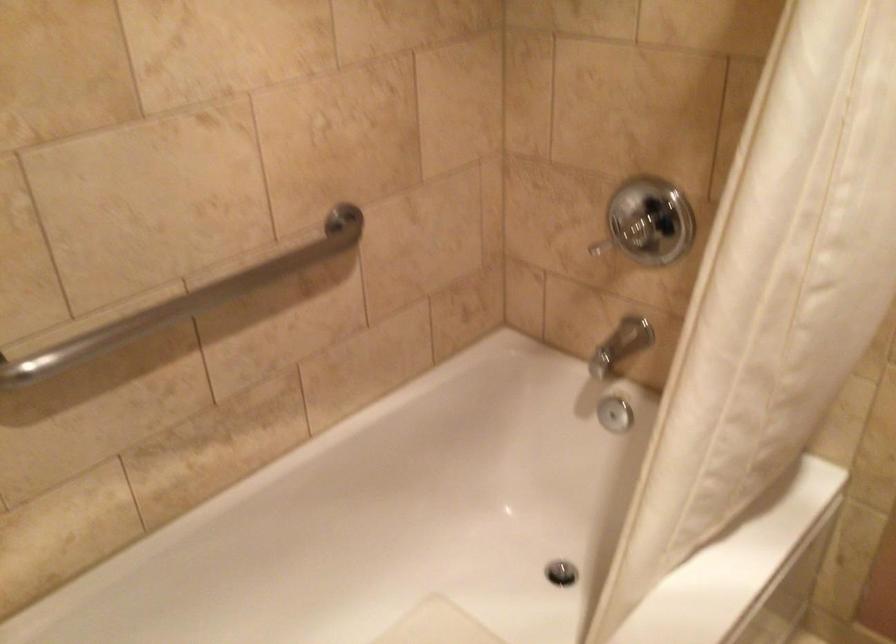
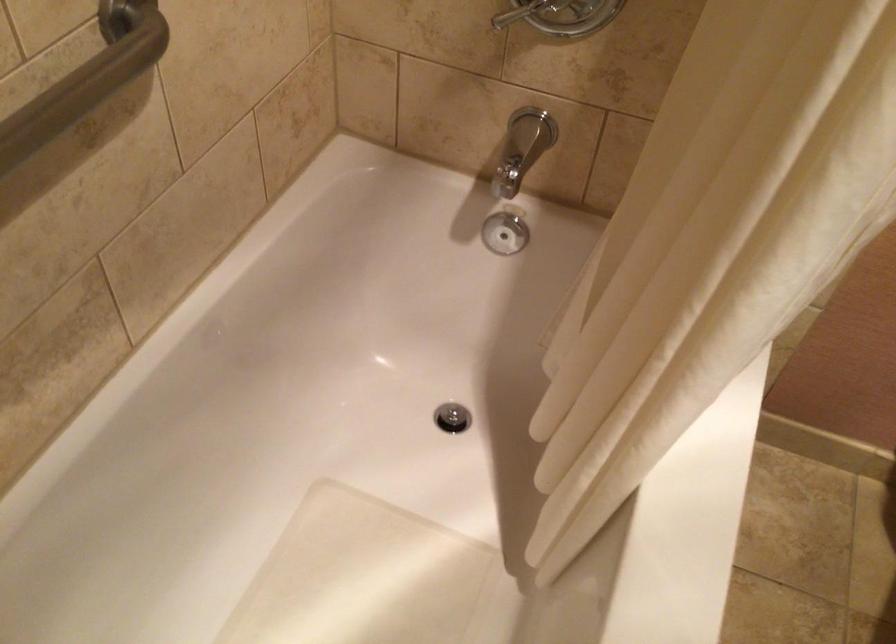
Which direction would the cameraman need to move to produce the second image?

The movement direction of the cameraman is left, forward.